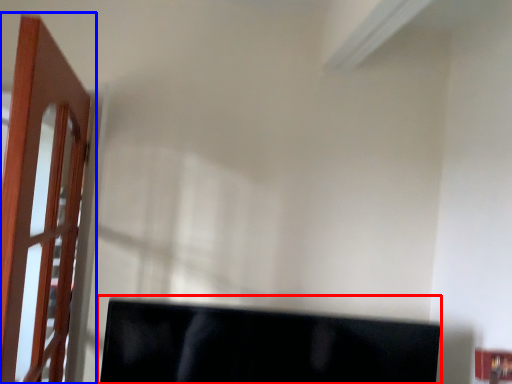
Question: Among these objects, which one is farthest to the camera, computer monitor (highlighted by a red box) or door (highlighted by a blue box)?

Choices:
 (A) computer monitor
 (B) door

Answer: (A)